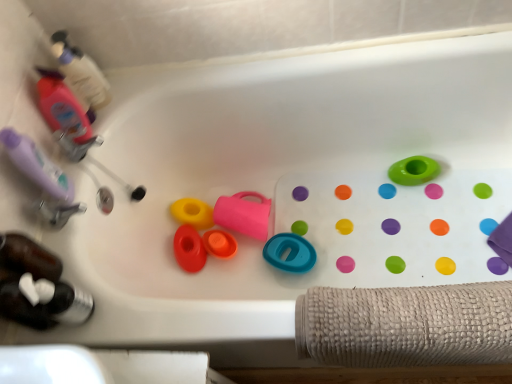
Question: Is green rubber ring at upper right, which ranks as the 1th toy in right-to-left order, not inside yellow rubber toy at center, the second toy positioned from the left?

Choices:
 (A) yes
 (B) no

Answer: (A)

Question: Is green rubber ring at upper right, which ranks as the 1th toy in right-to-left order, smaller than yellow rubber toy at center, the second toy positioned from the left?

Choices:
 (A) no
 (B) yes

Answer: (A)

Question: Is there a large distance between green rubber ring at upper right, which ranks as the 1th toy in right-to-left order, and yellow rubber toy at center, the second toy positioned from the left?

Choices:
 (A) no
 (B) yes

Answer: (A)

Question: Is the position of green rubber ring at upper right, which ranks as the 1th toy in right-to-left order, less distant than that of yellow rubber toy at center, the second toy positioned from the left?

Choices:
 (A) yes
 (B) no

Answer: (A)

Question: Is yellow rubber toy at center, the second toy positioned from the left, completely or partially inside green rubber ring at upper right, which ranks as the 1th toy in right-to-left order?

Choices:
 (A) yes
 (B) no

Answer: (B)

Question: Choose the correct answer: Is translucent plastic bottle at lower left, marked as the first bottle in a bottom-to-top arrangement, inside teal rubber ring at center, which is the second toy in right-to-left order, or outside it?

Choices:
 (A) inside
 (B) outside

Answer: (B)

Question: Considering the relative positions of translucent plastic bottle at lower left, the third bottle in the top-to-bottom sequence, and teal rubber ring at center, which is the second toy in right-to-left order, in the image provided, is translucent plastic bottle at lower left, the third bottle in the top-to-bottom sequence, to the left or to the right of teal rubber ring at center, which is the second toy in right-to-left order,?

Choices:
 (A) right
 (B) left

Answer: (B)

Question: From the image's perspective, is translucent plastic bottle at lower left, the third bottle in the top-to-bottom sequence, located above or below teal rubber ring at center, which is the second toy in right-to-left order?

Choices:
 (A) below
 (B) above

Answer: (A)

Question: Considering the positions of translucent plastic bottle at lower left, the third bottle in the top-to-bottom sequence, and teal rubber ring at center, which is the fifth toy in left-to-right order, in the image, is translucent plastic bottle at lower left, the third bottle in the top-to-bottom sequence, wider or thinner than teal rubber ring at center, which is the fifth toy in left-to-right order,?

Choices:
 (A) wide
 (B) thin

Answer: (B)

Question: Looking at their shapes, would you say teal rubber ring at center, which is the second toy in right-to-left order, is wider or thinner than translucent pink bottle at upper left, acting as the second bottle starting from the bottom?

Choices:
 (A) thin
 (B) wide

Answer: (B)

Question: Based on their positions, is teal rubber ring at center, which is the second toy in right-to-left order, located to the left or right of translucent pink bottle at upper left, acting as the second bottle starting from the bottom?

Choices:
 (A) left
 (B) right

Answer: (B)

Question: Do you think teal rubber ring at center, which is the second toy in right-to-left order, is within translucent pink bottle at upper left, the second bottle in the top-to-bottom sequence, or outside of it?

Choices:
 (A) inside
 (B) outside

Answer: (B)

Question: Looking at the image, does teal rubber ring at center, which is the second toy in right-to-left order, seem bigger or smaller compared to translucent pink bottle at upper left, the second bottle in the top-to-bottom sequence?

Choices:
 (A) small
 (B) big

Answer: (B)

Question: Which is correct: orange matte cup at center, which is the fourth toy in right-to-left order, is inside translucent pink bottle at upper left, the second bottle in the top-to-bottom sequence, or outside of it?

Choices:
 (A) outside
 (B) inside

Answer: (A)

Question: Is orange matte cup at center, which appears as the third toy when viewed from the left, in front of or behind translucent pink bottle at upper left, the second bottle in the top-to-bottom sequence, in the image?

Choices:
 (A) behind
 (B) front

Answer: (A)